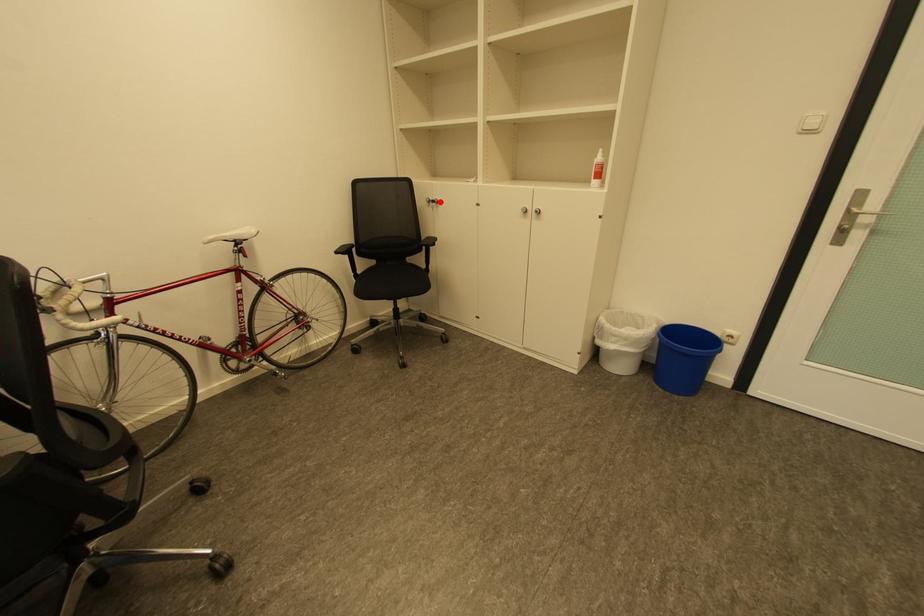
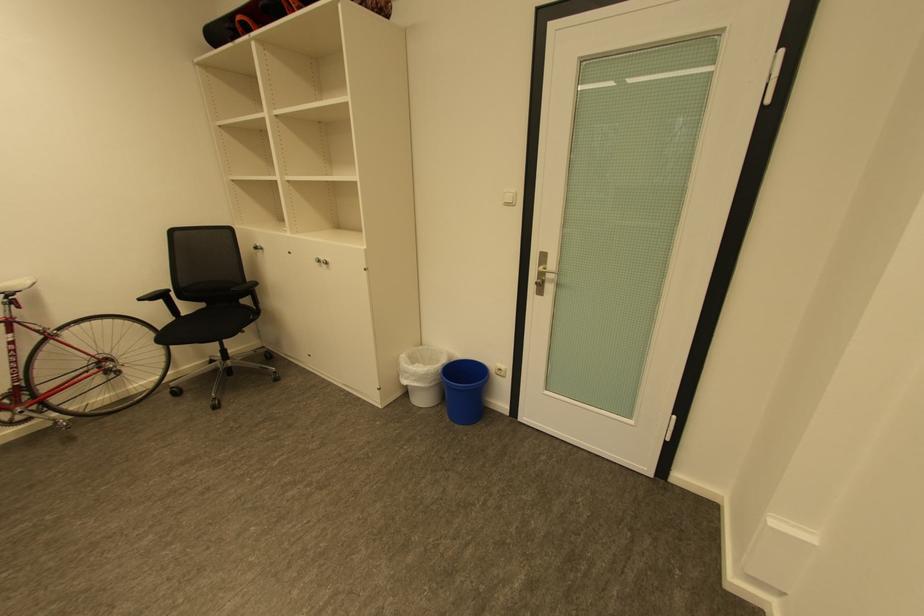
Question: I am providing you with two images of the same scene from different viewpoints. A red point is marked on the first image. Is the red point's position out of view in image 2?

Choices:
 (A) Yes
 (B) No

Answer: (B)